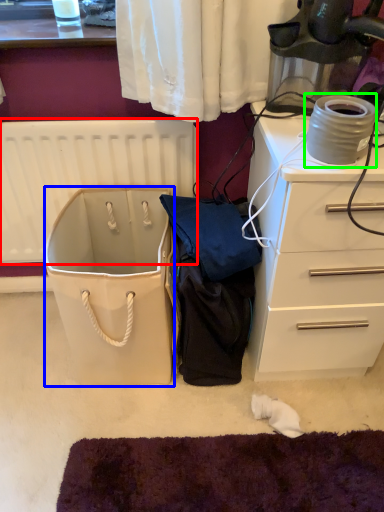
Question: Considering the real-world distances, which object is farthest from radiator (highlighted by a red box)? wide (highlighted by a blue box) or appliance (highlighted by a green box)?

Choices:
 (A) wide
 (B) appliance

Answer: (B)